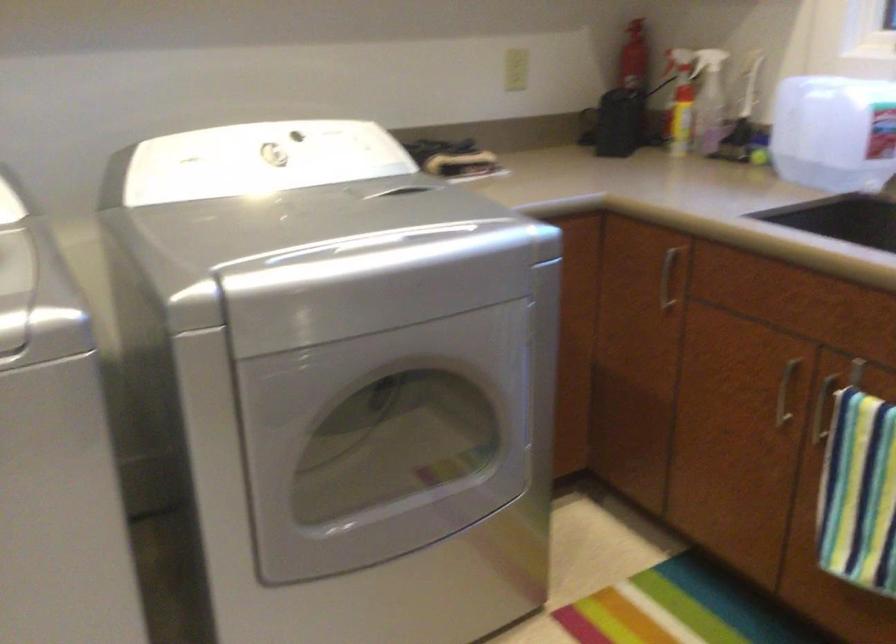
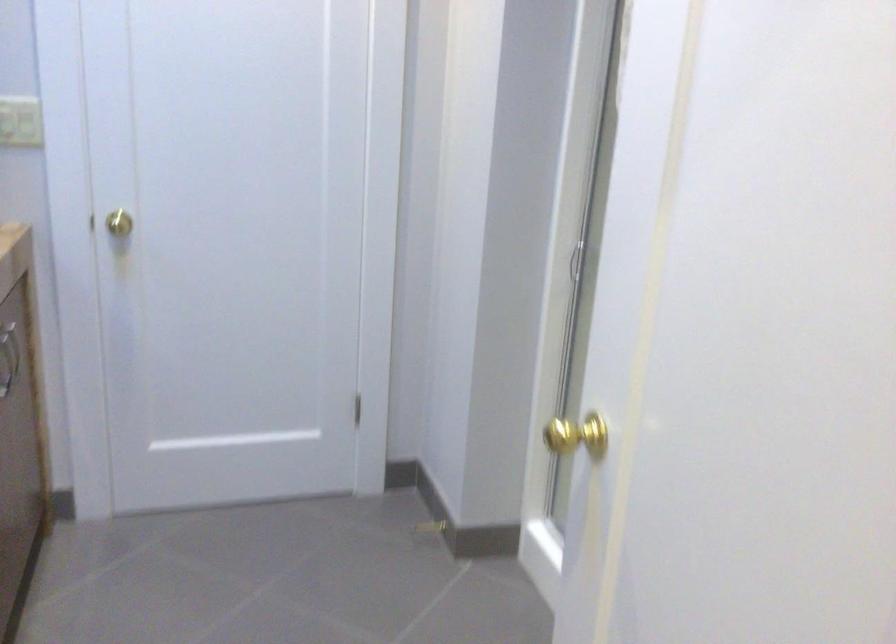
First-person continuous shooting, in which direction is the camera rotating?

The rotation direction of the camera is left-down.